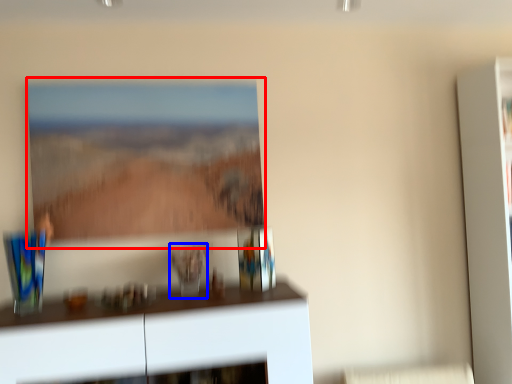
Question: Which object is further to the camera taking this photo, picture frame (highlighted by a red box) or glass vase (highlighted by a blue box)?

Choices:
 (A) picture frame
 (B) glass vase

Answer: (A)